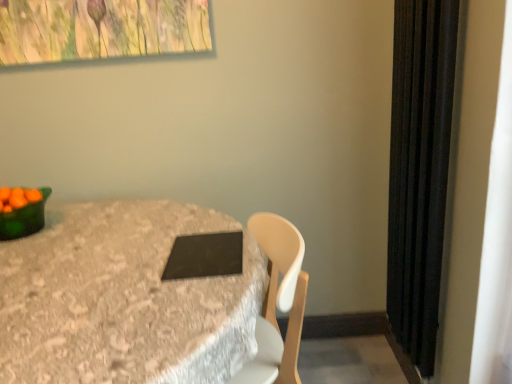
Where is `empty space that is ontop of black matte pad at center`? The width and height of the screenshot is (512, 384). empty space that is ontop of black matte pad at center is located at coordinates (209, 241).